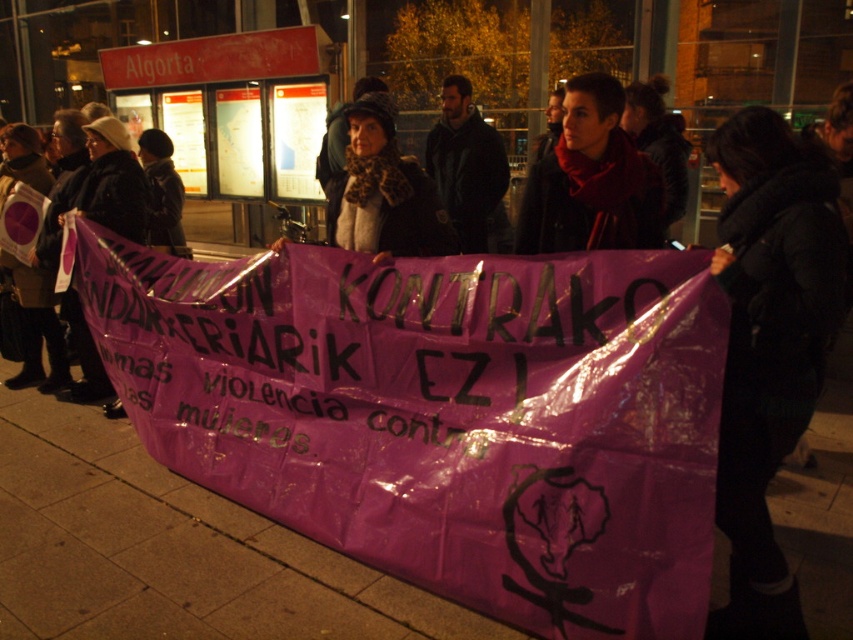
Between dark blue jacket at center and black woolen hat at upper left, which one appears on the left side from the viewer's perspective?

black woolen hat at upper left is more to the left.

Between point (436, 122) and point (120, 173), which one is positioned in front?

Point (120, 173)

Between point (482, 234) and point (83, 182), which one is positioned in front?

Positioned in front is point (83, 182).

At what (x,y) coordinates should I click in order to perform the action: click on dark blue jacket at center. Please return your answer as a coordinate pair (x, y). The image size is (853, 640). Looking at the image, I should click on (466, 164).

Between black fuzzy jacket at center and dark blue jacket at center, which one appears on the right side from the viewer's perspective?

From the viewer's perspective, black fuzzy jacket at center appears more on the right side.

Is black fuzzy jacket at center shorter than dark blue jacket at center?

No, black fuzzy jacket at center is not shorter than dark blue jacket at center.

The height and width of the screenshot is (640, 853). Describe the element at coordinates (769, 346) in the screenshot. I see `black fuzzy jacket at center` at that location.

Locate an element on the screen. The height and width of the screenshot is (640, 853). black fuzzy jacket at center is located at coordinates (769, 346).

Describe the element at coordinates (769, 346) in the screenshot. The height and width of the screenshot is (640, 853). I see `black fuzzy jacket at center` at that location.

Can you confirm if black fuzzy jacket at center is shorter than matte red scarf at center?

No.

Does point (744, 118) come farther from viewer compared to point (590, 81)?

No.

You are a GUI agent. You are given a task and a screenshot of the screen. Output one action in this format:
    pyautogui.click(x=<x>, y=<y>)
    Task: Click on the black fuzzy jacket at center
    
    Given the screenshot: What is the action you would take?
    pyautogui.click(x=769, y=346)